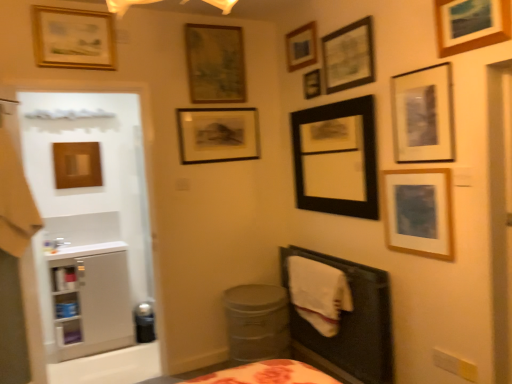
Question: Are matte black picture frame at upper center, positioned as the fourth picture frame in right-to-left order, and metallic gray potty at lower center, placed as the 2th potty when sorted from back to front, far apart?

Choices:
 (A) yes
 (B) no

Answer: (A)

Question: Does matte black picture frame at upper center, positioned as the fourth picture frame in right-to-left order, have a lesser height compared to metallic gray potty at lower center, the 1th potty from the front?

Choices:
 (A) yes
 (B) no

Answer: (A)

Question: From a real-world perspective, does matte black picture frame at upper center, which ranks as the eighth picture frame in left-to-right order, stand above metallic gray potty at lower center, the 1th potty when ordered from right to left?

Choices:
 (A) no
 (B) yes

Answer: (B)

Question: From the image's perspective, does matte black picture frame at upper center, positioned as the fourth picture frame in right-to-left order, appear lower than metallic gray potty at lower center, the 1th potty when ordered from right to left?

Choices:
 (A) no
 (B) yes

Answer: (A)

Question: Could you tell me if matte black picture frame at upper center, positioned as the fourth picture frame in right-to-left order, is turned towards metallic gray potty at lower center, the 1th potty when ordered from right to left?

Choices:
 (A) yes
 (B) no

Answer: (B)

Question: Is matte black picture frame at upper center, which ranks as the eighth picture frame in left-to-right order, turned away from metallic gray potty at lower center, the 1th potty when ordered from right to left?

Choices:
 (A) no
 (B) yes

Answer: (A)

Question: Can you confirm if gold-framed picture at upper left, which ranks as the tenth picture frame in right-to-left order, is bigger than wooden picture frame at upper right, which ranks as the 11th picture frame in left-to-right order?

Choices:
 (A) yes
 (B) no

Answer: (A)

Question: Considering the relative sizes of gold-framed picture at upper left, the 2th picture frame from the left, and wooden picture frame at upper right, which ranks as the 11th picture frame in left-to-right order, in the image provided, is gold-framed picture at upper left, the 2th picture frame from the left, shorter than wooden picture frame at upper right, which ranks as the 11th picture frame in left-to-right order,?

Choices:
 (A) no
 (B) yes

Answer: (A)

Question: Is gold-framed picture at upper left, which ranks as the tenth picture frame in right-to-left order, to the right of wooden picture frame at upper right, which ranks as the 11th picture frame in left-to-right order, from the viewer's perspective?

Choices:
 (A) no
 (B) yes

Answer: (A)

Question: Would you say wooden picture frame at upper right, which ranks as the 11th picture frame in left-to-right order, is part of gold-framed picture at upper left, which ranks as the tenth picture frame in right-to-left order,'s contents?

Choices:
 (A) no
 (B) yes

Answer: (A)

Question: Does gold-framed picture at upper left, the 2th picture frame from the left, have a greater width compared to wooden picture frame at upper right, the first picture frame positioned from the right?

Choices:
 (A) no
 (B) yes

Answer: (B)

Question: From the image's perspective, is gold-framed picture at upper left, the 2th picture frame from the left, on wooden picture frame at upper right, which ranks as the 11th picture frame in left-to-right order?

Choices:
 (A) yes
 (B) no

Answer: (A)

Question: Can you confirm if black matte picture frame at upper center, which is the 7th picture frame from left to right, is smaller than matte black picture frame at upper right, the 3th picture frame from the right?

Choices:
 (A) no
 (B) yes

Answer: (A)